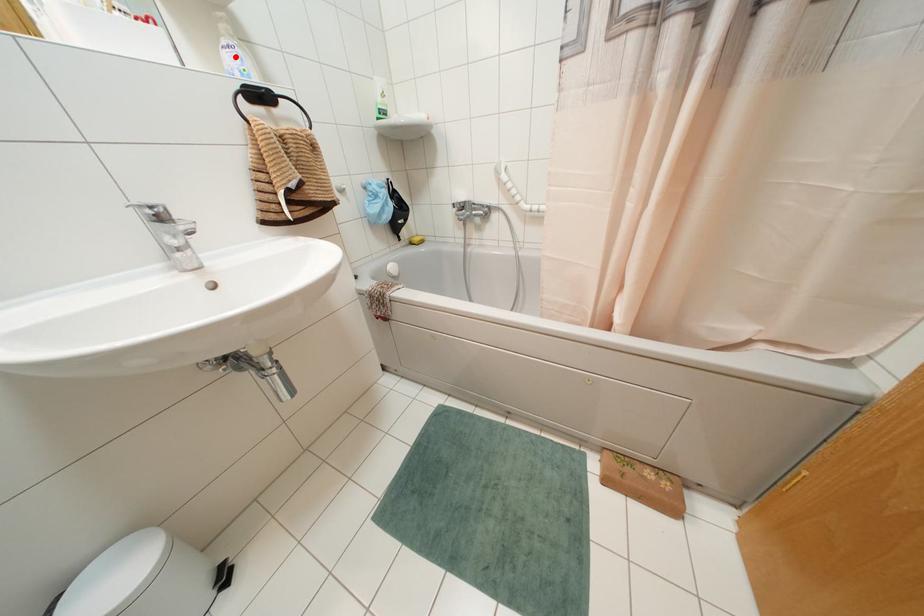
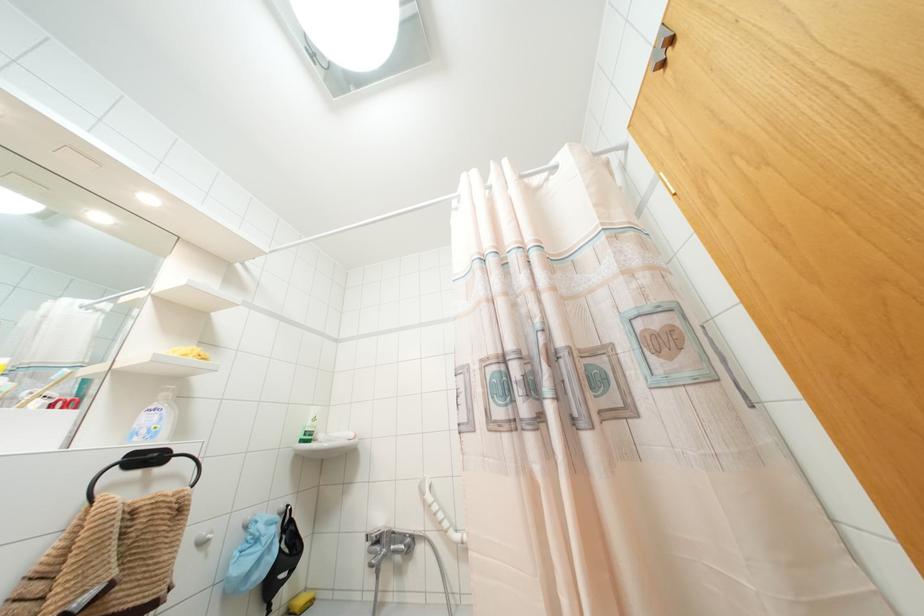
In the second image, find the point that corresponds to the highlighted location in the first image.

(154, 418)